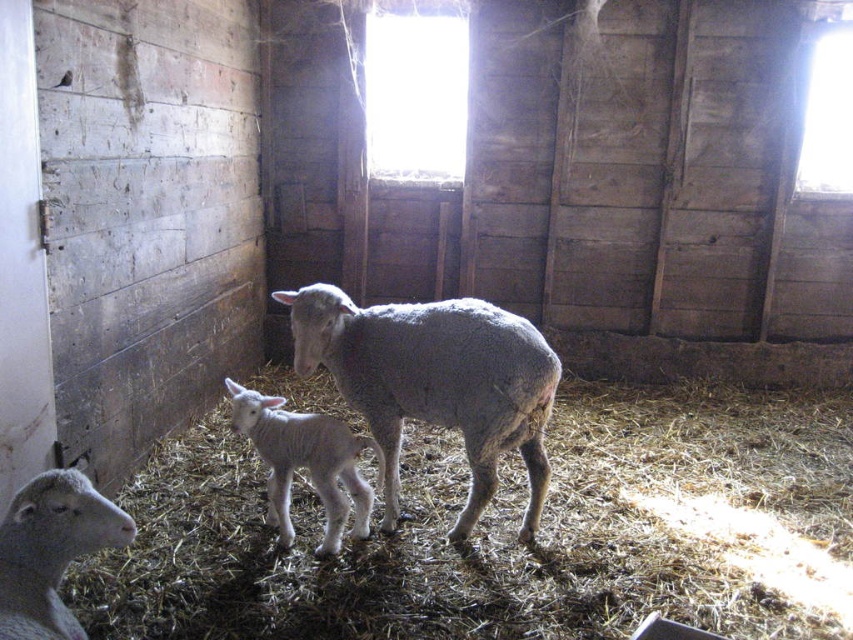
Between gray woolen sheep at center and gray woolen sheep at lower left, which one has more height?

With more height is gray woolen sheep at center.

Can you confirm if gray woolen sheep at center is positioned to the left of gray woolen sheep at lower left?

In fact, gray woolen sheep at center is to the right of gray woolen sheep at lower left.

Find the location of a particular element. The width and height of the screenshot is (853, 640). gray woolen sheep at center is located at coordinates (434, 381).

Does gray woolen sheep at center appear on the right side of white woolen lamb at center?

Correct, you'll find gray woolen sheep at center to the right of white woolen lamb at center.

Can you confirm if gray woolen sheep at center is positioned below white woolen lamb at center?

Incorrect, gray woolen sheep at center is not positioned below white woolen lamb at center.

Measure the distance between gray woolen sheep at center and camera.

gray woolen sheep at center and camera are 2.59 meters apart.

Identify the location of gray woolen sheep at center. The image size is (853, 640). (434, 381).

Does fuzzy straw at lower left have a greater height compared to gray woolen sheep at center?

In fact, fuzzy straw at lower left may be shorter than gray woolen sheep at center.

Which is more to the right, fuzzy straw at lower left or gray woolen sheep at center?

fuzzy straw at lower left is more to the right.

Does point (572, 545) lie behind point (509, 323)?

Yes, it is behind point (509, 323).

Where is `fuzzy straw at lower left`? The height and width of the screenshot is (640, 853). fuzzy straw at lower left is located at coordinates (506, 531).